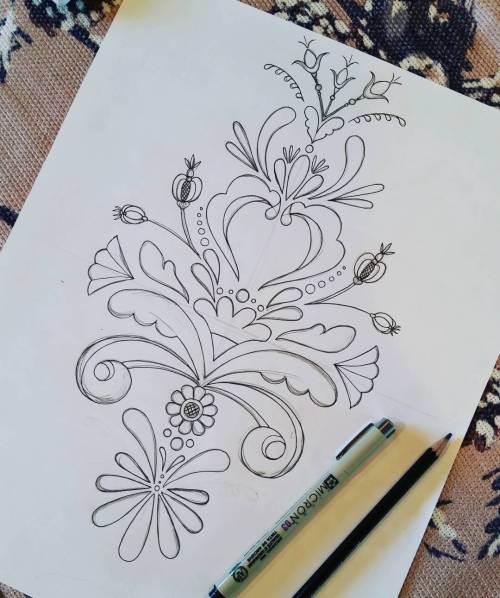
Identify the location of tablecloth. (21, 67), (470, 543), (440, 48).